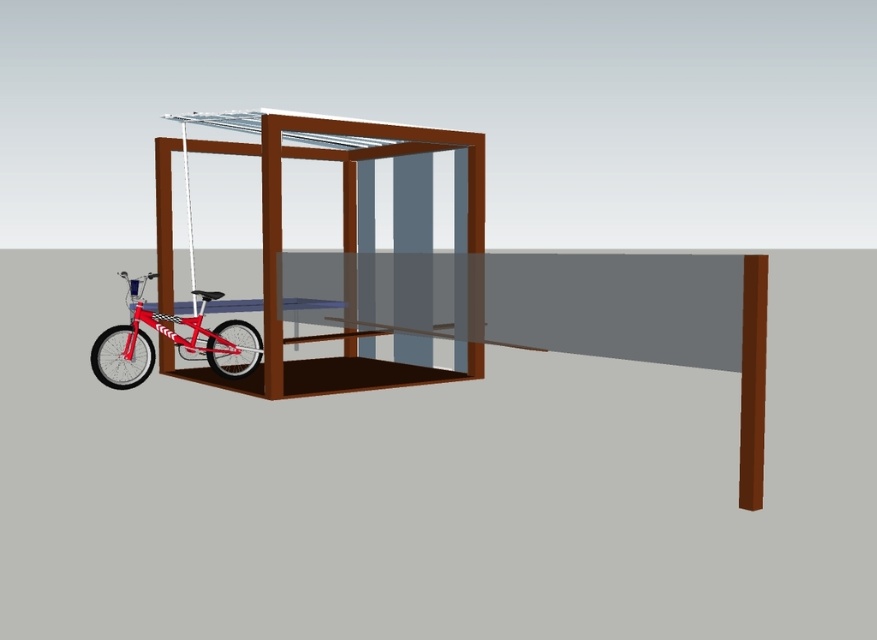
You are planning to place a shiny red bicycle at left inside a brown matte gazebo at left. Based on their sizes, will the bicycle fit inside the gazebo?

The brown matte gazebo at left might be wider than shiny red bicycle at left, so there is a possibility that the bicycle will fit inside the gazebo. However, the exact dimensions are uncertain.

You are standing at the entrance of the structure and want to place a new bench. The bench requires 1.2 meters of space. Is there enough space in the brown matte gazebo at left to accommodate the bench?

The position of brown matte gazebo at left is at point (347, 234), but without information about its dimensions or available space, it is impossible to determine if the bench will fit.

You are designing a layout for a small outdoor space and need to place both the brown matte gazebo at left and the shiny red bicycle at left. Given their sizes, which object should you place first to ensure they both fit in the space?

The brown matte gazebo at left occupies less space than the shiny red bicycle at left, so you should place the shiny red bicycle at left first to ensure there is enough room for both.